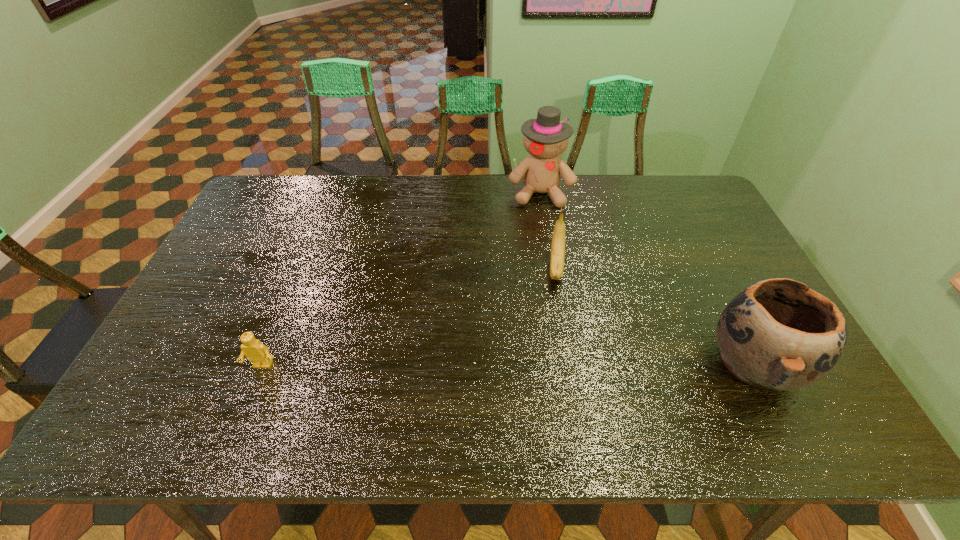
This screenshot has height=540, width=960. What are the coordinates of `empty space that is in between the second farthest object and the tallest object` in the screenshot? It's located at (548, 230).

Identify the location of vacant space that's between the shortest object and the third tallest object. (409, 316).

Identify the location of vacant region between the tallest object and the rightmost object. The width and height of the screenshot is (960, 540). (648, 279).

Locate an element on the screen. vacant space that's between the second farthest object and the second tallest object is located at coordinates (656, 316).

I want to click on vacant space that is in between the leftmost object and the rightmost object, so click(509, 365).

Find the location of a particular element. The height and width of the screenshot is (540, 960). object that can be found as the third closest to the second farthest object is located at coordinates (256, 352).

This screenshot has height=540, width=960. Find the location of `object that is the second closest to the second tallest object`. object that is the second closest to the second tallest object is located at coordinates (545, 138).